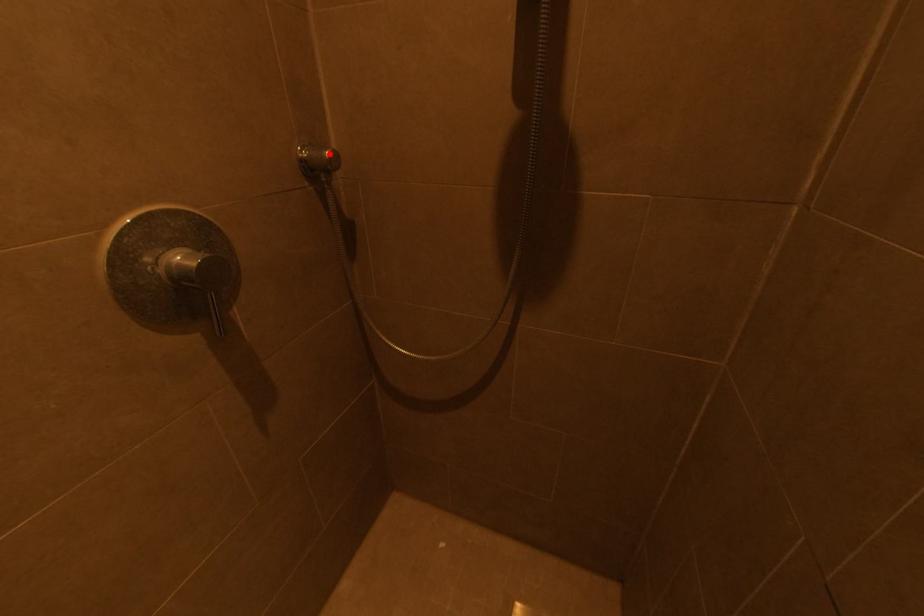
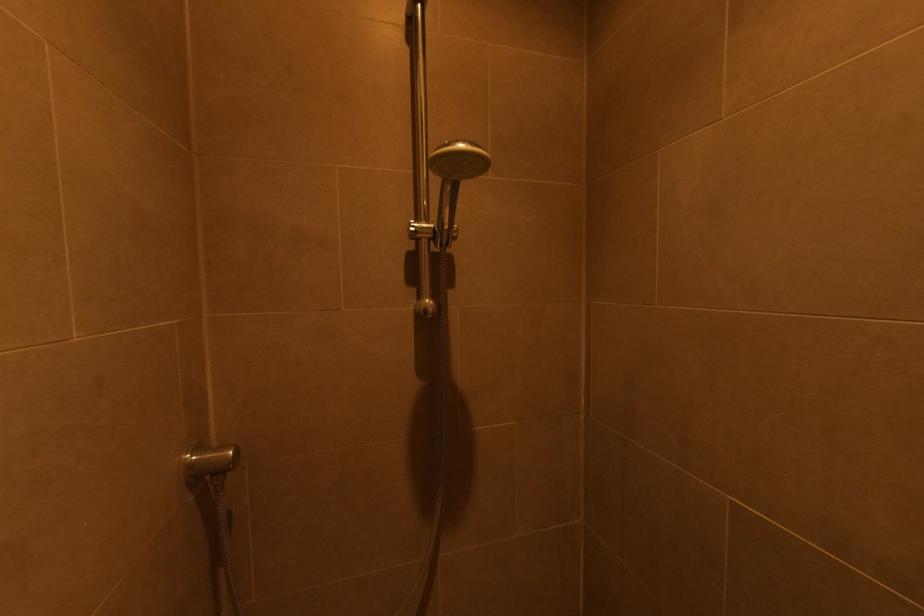
The point at the highlighted location is marked in the first image. Where is the corresponding point in the second image?

(232, 454)